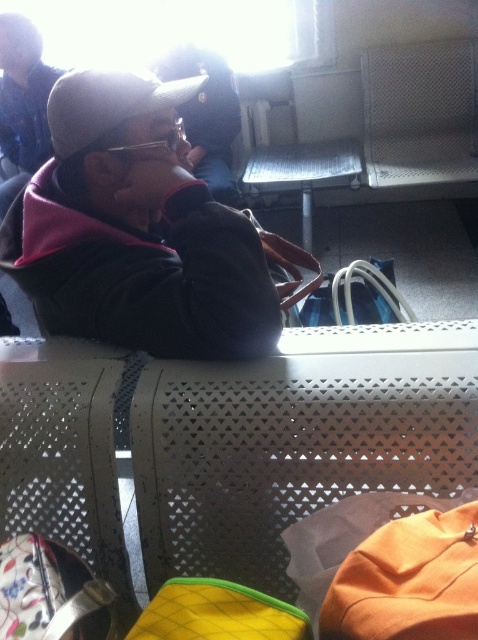
Can you confirm if matte black jacket at center is positioned above matte black cap at upper left?

No, matte black jacket at center is not above matte black cap at upper left.

Can you confirm if matte black jacket at center is positioned to the right of matte black cap at upper left?

Indeed, matte black jacket at center is positioned on the right side of matte black cap at upper left.

Which is in front, point (128, 189) or point (34, 81)?

Positioned in front is point (128, 189).

Where is `matte black jacket at center`? The height and width of the screenshot is (640, 478). matte black jacket at center is located at coordinates (136, 230).

Is matte black cap at upper left smaller than matte black jacket at upper center?

No, matte black cap at upper left is not smaller than matte black jacket at upper center.

Is matte black cap at upper left to the left of matte black jacket at upper center from the viewer's perspective?

Yes, matte black cap at upper left is to the left of matte black jacket at upper center.

This screenshot has height=640, width=478. Describe the element at coordinates (22, 100) in the screenshot. I see `matte black cap at upper left` at that location.

At what (x,y) coordinates should I click in order to perform the action: click on matte black cap at upper left. Please return your answer as a coordinate pair (x, y). Image resolution: width=478 pixels, height=640 pixels. Looking at the image, I should click on (22, 100).

Which is in front, point (34, 218) or point (195, 72)?

Point (34, 218) is in front.

Is matte black jacket at center thinner than matte black jacket at upper center?

No.

Is point (46, 109) in front of point (217, 138)?

Yes, it is in front of point (217, 138).

Where is `matte black jacket at center`? The width and height of the screenshot is (478, 640). matte black jacket at center is located at coordinates (136, 230).